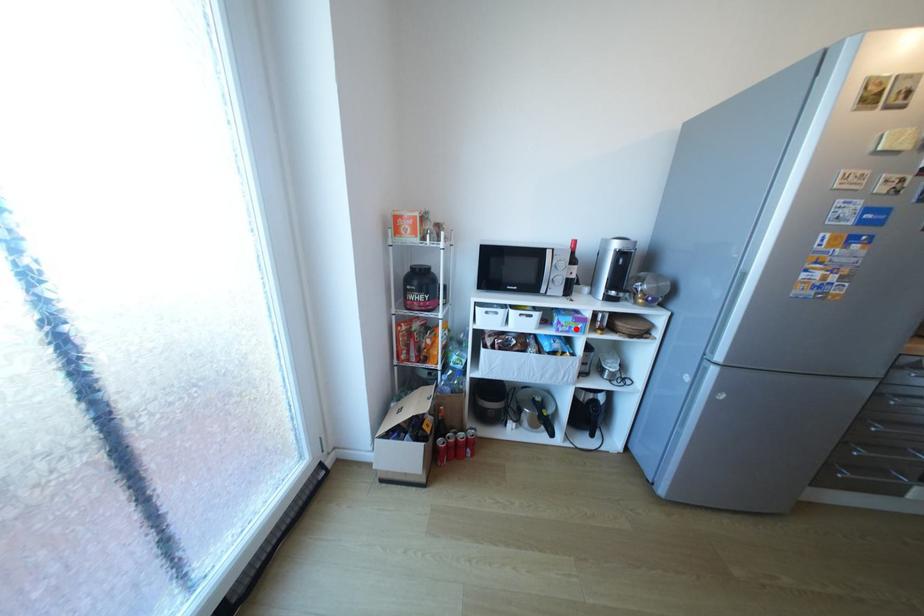
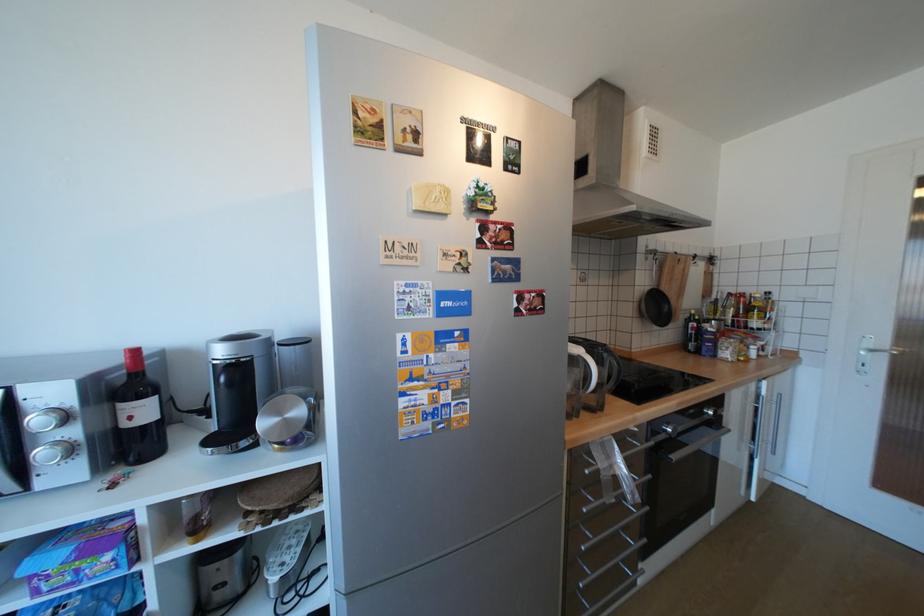
In the second image, find the point that corresponds to the highlighted location in the first image.

(79, 578)